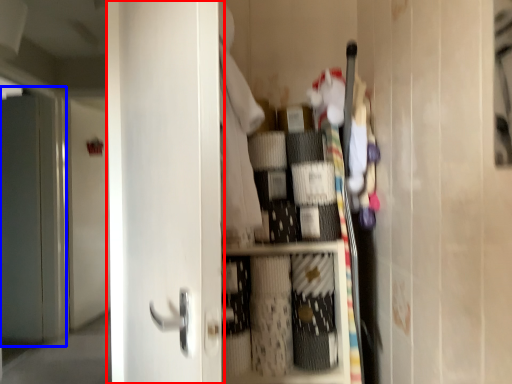
Question: Among these objects, which one is nearest to the camera, door (highlighted by a red box) or screen door (highlighted by a blue box)?

Choices:
 (A) door
 (B) screen door

Answer: (A)